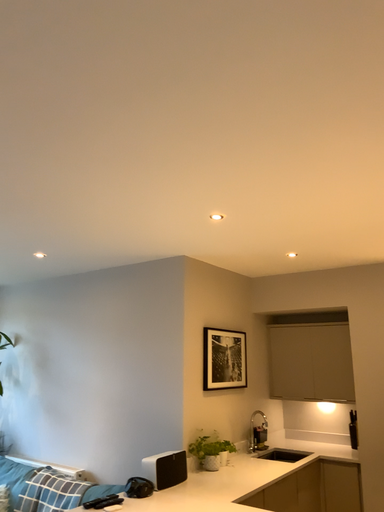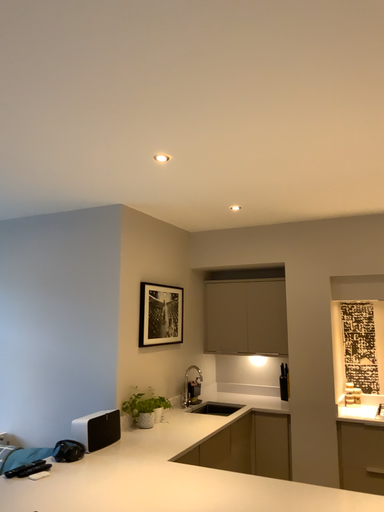
Question: How did the camera likely rotate when shooting the video?

Choices:
 (A) rotated right
 (B) rotated left

Answer: (A)